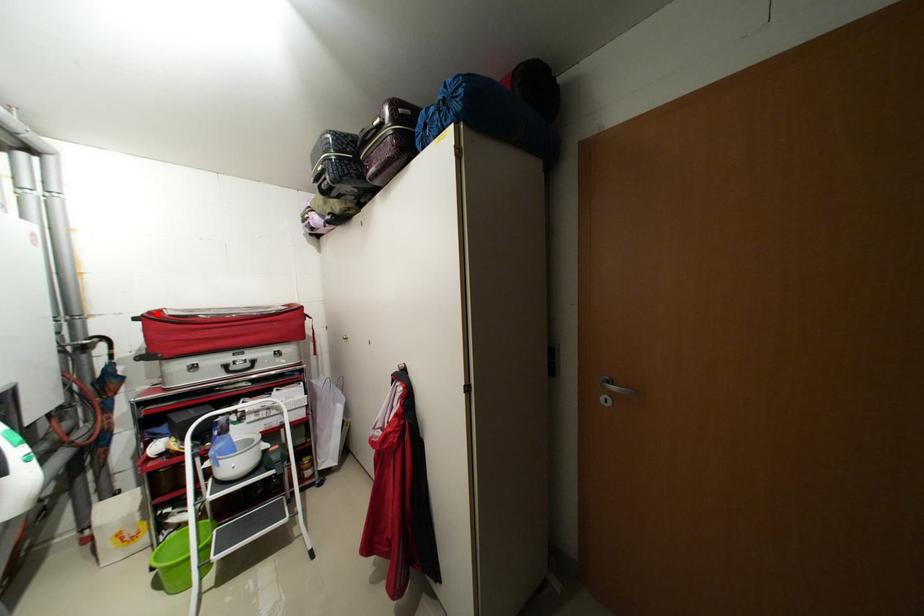
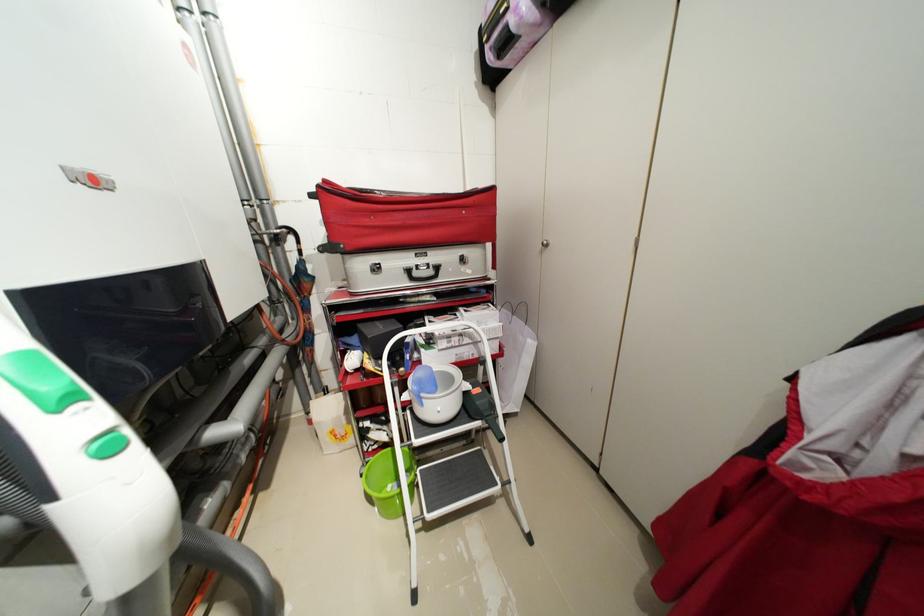
In the second image, find the point that corresponds to the highlighted location in the first image.

(332, 182)